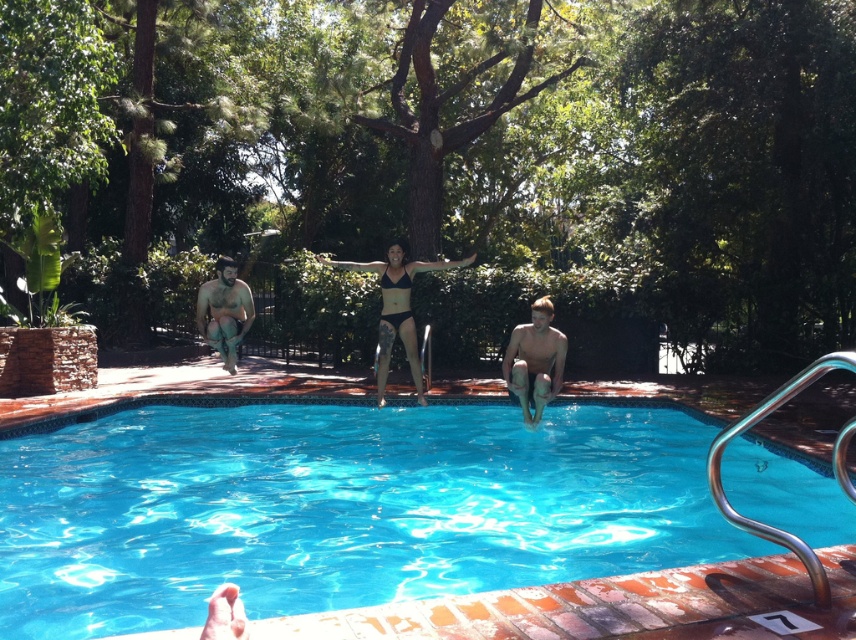
Which is behind, point (348, 516) or point (395, 296)?

The point (395, 296) is more distant.

Between point (471, 500) and point (415, 349), which one is positioned in front?

Point (471, 500) is more forward.

Locate an element on the screen. This screenshot has height=640, width=856. blue glossy water at center is located at coordinates (336, 508).

At what (x,y) coordinates should I click in order to perform the action: click on blue glossy water at center. Please return your answer as a coordinate pair (x, y). This screenshot has height=640, width=856. Looking at the image, I should click on (336, 508).

Find the location of a particular element. The width and height of the screenshot is (856, 640). black matte bikini at center is located at coordinates (396, 308).

Who is more forward, (391,260) or (230,328)?

Point (230,328) is more forward.

Locate an element on the screen. black matte bikini at center is located at coordinates [x=396, y=308].

Locate an element on the screen. black matte bikini at center is located at coordinates (396, 308).

Which is behind, point (401, 308) or point (533, 321)?

The point (401, 308) is behind.

Is point (418, 392) more distant than point (522, 353)?

That is True.

Identify the location of black matte bikini at center. (396, 308).